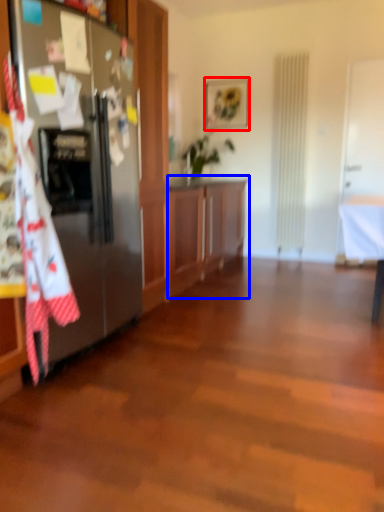
Question: Which object is further to the camera taking this photo, picture frame (highlighted by a red box) or cabinetry (highlighted by a blue box)?

Choices:
 (A) picture frame
 (B) cabinetry

Answer: (A)